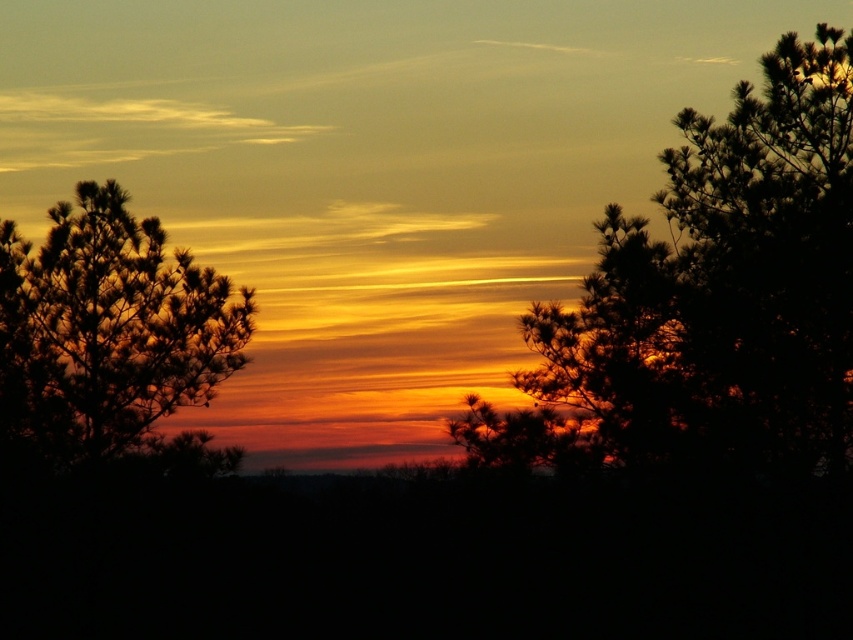
Locate an element on the screen. The height and width of the screenshot is (640, 853). dark green textured tree at right is located at coordinates (711, 300).

Is dark green textured tree at right below silhouette pine tree at left?

Indeed, dark green textured tree at right is positioned under silhouette pine tree at left.

Identify the location of dark green textured tree at right. Image resolution: width=853 pixels, height=640 pixels. (711, 300).